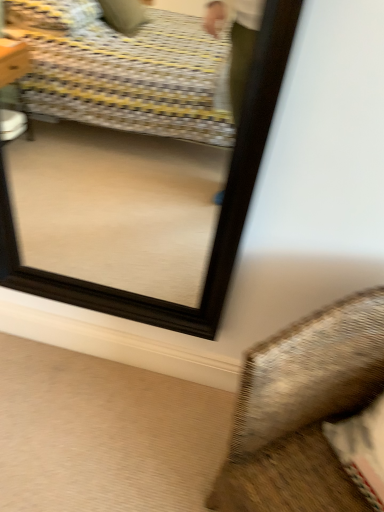
Question: Considering the relative positions of textured fabric pillow at lower right and black wooden mirror at upper center in the image provided, is textured fabric pillow at lower right to the left or to the right of black wooden mirror at upper center?

Choices:
 (A) left
 (B) right

Answer: (B)

Question: Is textured fabric pillow at lower right inside or outside of black wooden mirror at upper center?

Choices:
 (A) outside
 (B) inside

Answer: (A)

Question: Is textured fabric pillow at lower right wider or thinner than black wooden mirror at upper center?

Choices:
 (A) thin
 (B) wide

Answer: (B)

Question: Does point (76, 285) appear closer or farther from the camera than point (261, 474)?

Choices:
 (A) closer
 (B) farther

Answer: (B)

Question: Considering the positions of black wooden mirror at upper center and textured fabric pillow at lower right in the image, is black wooden mirror at upper center bigger or smaller than textured fabric pillow at lower right?

Choices:
 (A) small
 (B) big

Answer: (A)

Question: From the image's perspective, is black wooden mirror at upper center located above or below textured fabric pillow at lower right?

Choices:
 (A) below
 (B) above

Answer: (B)

Question: Considering the positions of black wooden mirror at upper center and textured fabric pillow at lower right in the image, is black wooden mirror at upper center wider or thinner than textured fabric pillow at lower right?

Choices:
 (A) wide
 (B) thin

Answer: (B)